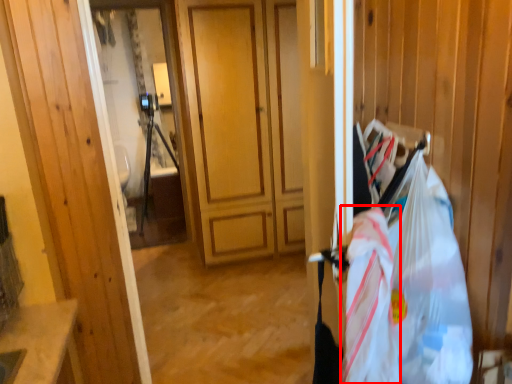
Question: From the image's perspective, where is grocery bag (annotated by the red box) located relative to grocery bag?

Choices:
 (A) below
 (B) above

Answer: (A)